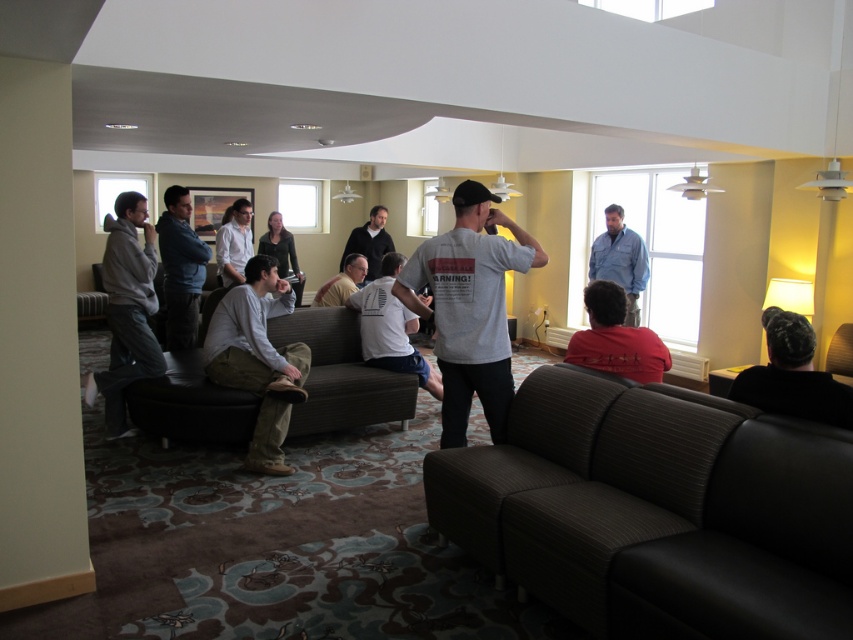
You are standing in the lounge area and see the dark blue jeans at center. Where exactly are the dark blue jeans located in the room?

The dark blue jeans at center are located at point (180, 268) in the room.